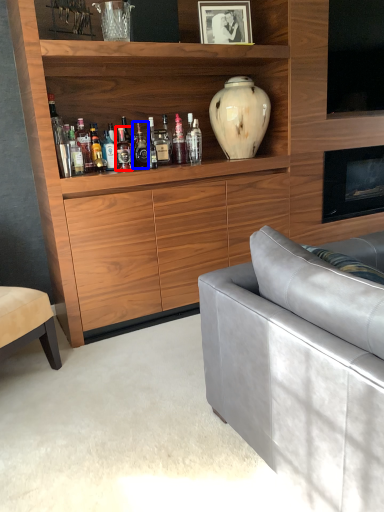
Question: Among these objects, which one is farthest to the camera, bottle (highlighted by a red box) or bottle (highlighted by a blue box)?

Choices:
 (A) bottle
 (B) bottle

Answer: (B)